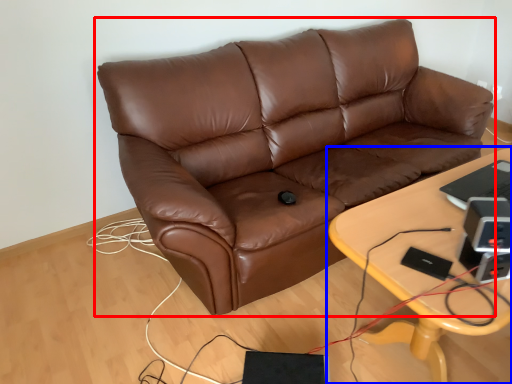
Question: Which of the following is the closest to the observer, studio couch (highlighted by a red box) or table (highlighted by a blue box)?

Choices:
 (A) studio couch
 (B) table

Answer: (B)